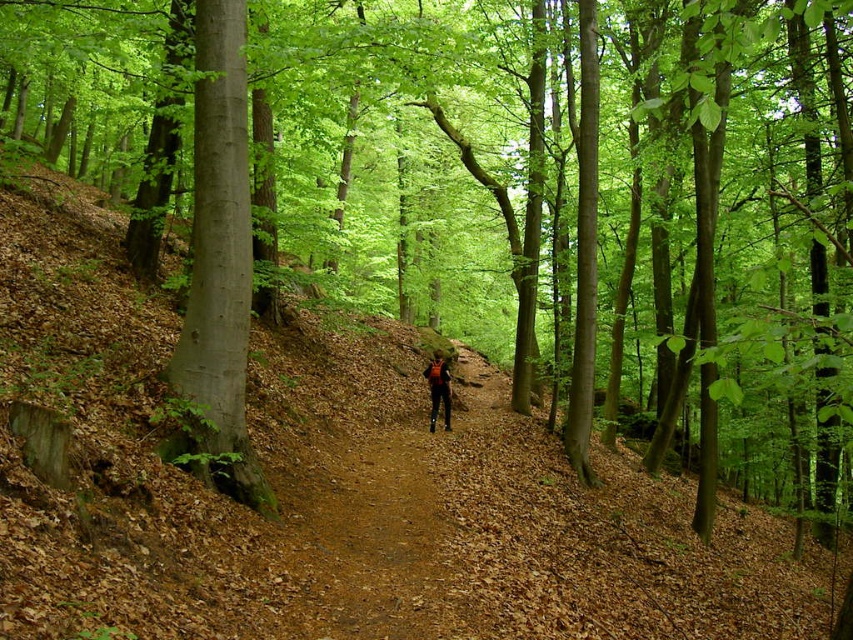
Is brown gravel path at center thinner than smooth gray tree trunk at left?

Yes.

Is brown gravel path at center to the right of smooth gray tree trunk at left from the viewer's perspective?

Yes, brown gravel path at center is to the right of smooth gray tree trunk at left.

Does point (399, 552) lie behind point (225, 275)?

No, (399, 552) is in front of (225, 275).

The image size is (853, 640). What are the coordinates of `brown gravel path at center` in the screenshot? It's located at tap(368, 538).

Is smooth gray tree trunk at left above camouflage fabric backpack at center?

Indeed, smooth gray tree trunk at left is positioned over camouflage fabric backpack at center.

Describe the element at coordinates (219, 262) in the screenshot. The width and height of the screenshot is (853, 640). I see `smooth gray tree trunk at left` at that location.

Is point (194, 132) positioned in front of point (432, 410)?

That is True.

Where is `smooth gray tree trunk at left`? smooth gray tree trunk at left is located at coordinates (219, 262).

Is brown gravel path at center shorter than camouflage fabric backpack at center?

Indeed, brown gravel path at center has a lesser height compared to camouflage fabric backpack at center.

Does brown gravel path at center appear under camouflage fabric backpack at center?

Yes, brown gravel path at center is below camouflage fabric backpack at center.

Who is more forward, (407, 634) or (434, 406)?

Point (407, 634) is in front.

Identify the location of brown gravel path at center. Image resolution: width=853 pixels, height=640 pixels. (368, 538).